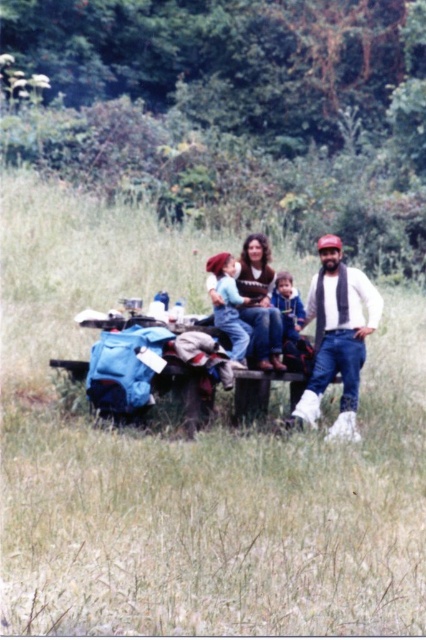
In the scene shown: Is white matte scarf at right thinner than light blue denim overalls at center?

No.

Which is in front, point (321, 273) or point (290, 294)?

Point (321, 273)

Between point (331, 426) and point (288, 298), which one is positioned in front?

Point (331, 426) is in front.

Locate an element on the screen. The width and height of the screenshot is (426, 640). white matte scarf at right is located at coordinates [337, 337].

Who is higher up, knitted sweater at center or light blue denim overalls at center?

knitted sweater at center is higher up.

Can you confirm if knitted sweater at center is thinner than light blue denim overalls at center?

In fact, knitted sweater at center might be wider than light blue denim overalls at center.

Between point (262, 362) and point (282, 276), which one is positioned behind?

Positioned behind is point (282, 276).

Where is `knitted sweater at center`? knitted sweater at center is located at coordinates (259, 301).

Who is shorter, light blue denim jeans at center or light blue denim overalls at center?

With less height is light blue denim overalls at center.

Who is more forward, (216, 317) or (282, 269)?

Point (216, 317) is more forward.

The image size is (426, 640). What are the coordinates of `light blue denim jeans at center` in the screenshot? It's located at (229, 305).